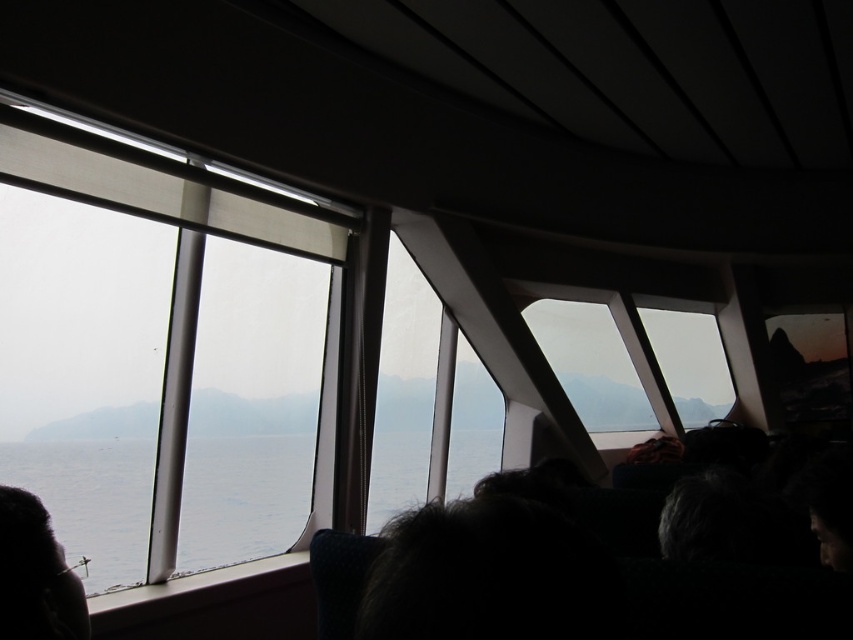
You are a passenger on the ferry and want to take a photo of the transparent glass water at center through the clear glass window at upper left. Is the window positioned in a way that allows you to capture the water in the photo?

The clear glass window at upper left is positioned over transparent glass water at center, so yes, the window is above the water and you can take the photo by looking downward through the window.